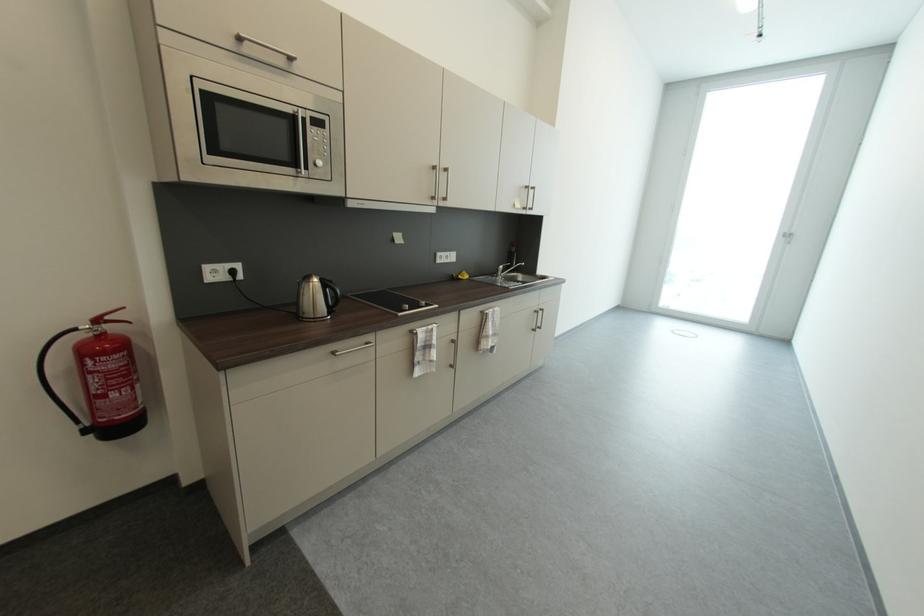
Locate an element on the screen. The height and width of the screenshot is (616, 924). silver electric kettle is located at coordinates (315, 298).